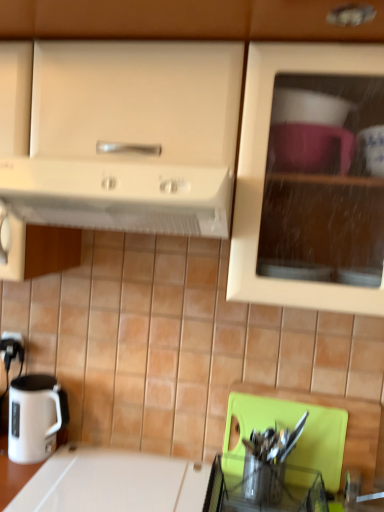
Question: Is matte white cabinet at upper center in front of white glossy countertop at lower left?

Choices:
 (A) no
 (B) yes

Answer: (B)

Question: Is matte white cabinet at upper center positioned with its back to white glossy countertop at lower left?

Choices:
 (A) yes
 (B) no

Answer: (B)

Question: Can you confirm if matte white cabinet at upper center is positioned to the left of white glossy countertop at lower left?

Choices:
 (A) no
 (B) yes

Answer: (A)

Question: Is matte white cabinet at upper center completely or partially outside of white glossy countertop at lower left?

Choices:
 (A) yes
 (B) no

Answer: (A)

Question: From a real-world perspective, is matte white cabinet at upper center over white glossy countertop at lower left?

Choices:
 (A) yes
 (B) no

Answer: (A)

Question: In terms of width, does white matte range hood at upper center look wider or thinner when compared to matte white cabinet at upper center?

Choices:
 (A) thin
 (B) wide

Answer: (A)

Question: From the image's perspective, is white matte range hood at upper center located above or below matte white cabinet at upper center?

Choices:
 (A) above
 (B) below

Answer: (B)

Question: In the image, is white matte range hood at upper center on the left side or the right side of matte white cabinet at upper center?

Choices:
 (A) left
 (B) right

Answer: (A)

Question: Is point (29, 172) closer or farther from the camera than point (296, 0)?

Choices:
 (A) farther
 (B) closer

Answer: (A)

Question: From their relative heights in the image, would you say white glossy countertop at lower left is taller or shorter than white matte range hood at upper center?

Choices:
 (A) short
 (B) tall

Answer: (B)

Question: From a real-world perspective, is white glossy countertop at lower left positioned above or below white matte range hood at upper center?

Choices:
 (A) below
 (B) above

Answer: (A)

Question: Would you say white glossy countertop at lower left is to the left or to the right of white matte range hood at upper center in the picture?

Choices:
 (A) left
 (B) right

Answer: (A)

Question: Would you say white glossy countertop at lower left is inside or outside white matte range hood at upper center?

Choices:
 (A) outside
 (B) inside

Answer: (A)

Question: From their relative heights in the image, would you say white glossy electric kettle at lower left is taller or shorter than white plastic electric outlet at lower left?

Choices:
 (A) short
 (B) tall

Answer: (B)

Question: From the image's perspective, is white glossy electric kettle at lower left positioned above or below white plastic electric outlet at lower left?

Choices:
 (A) below
 (B) above

Answer: (A)